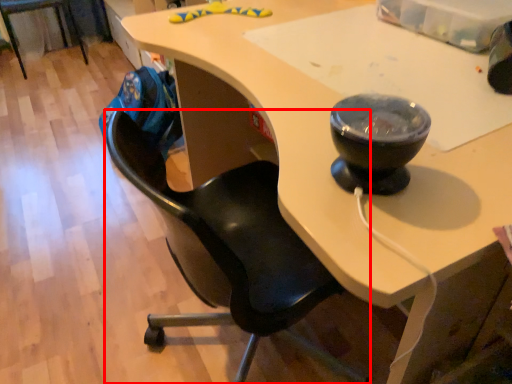
Question: From the image, what is the correct spatial relationship of chair (annotated by the red box) in relation to chair?

Choices:
 (A) right
 (B) left

Answer: (A)